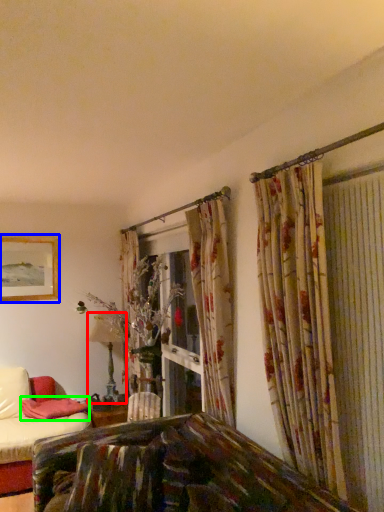
Question: Which object is positioned closest to table lamp (highlighted by a red box)? Select from picture frame (highlighted by a blue box) and pillow (highlighted by a green box).

Choices:
 (A) picture frame
 (B) pillow

Answer: (B)